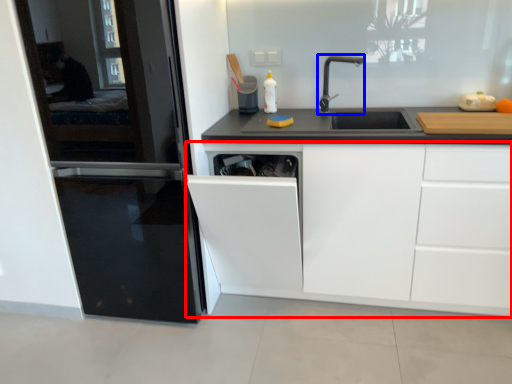
Question: Which object is closer to the camera taking this photo, cabinetry (highlighted by a red box) or tap (highlighted by a blue box)?

Choices:
 (A) cabinetry
 (B) tap

Answer: (A)